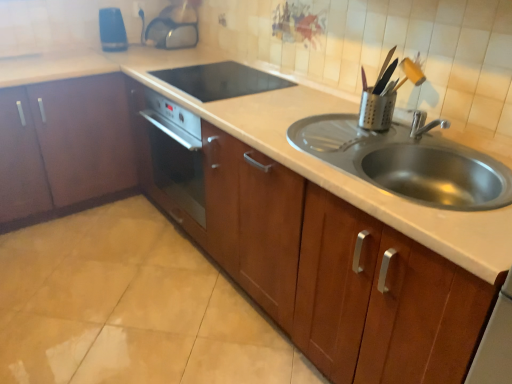
This screenshot has height=384, width=512. I want to click on unoccupied area in front of metallic silver utensil holder at upper right, which is the 4th appliance in left-to-right order, so click(369, 137).